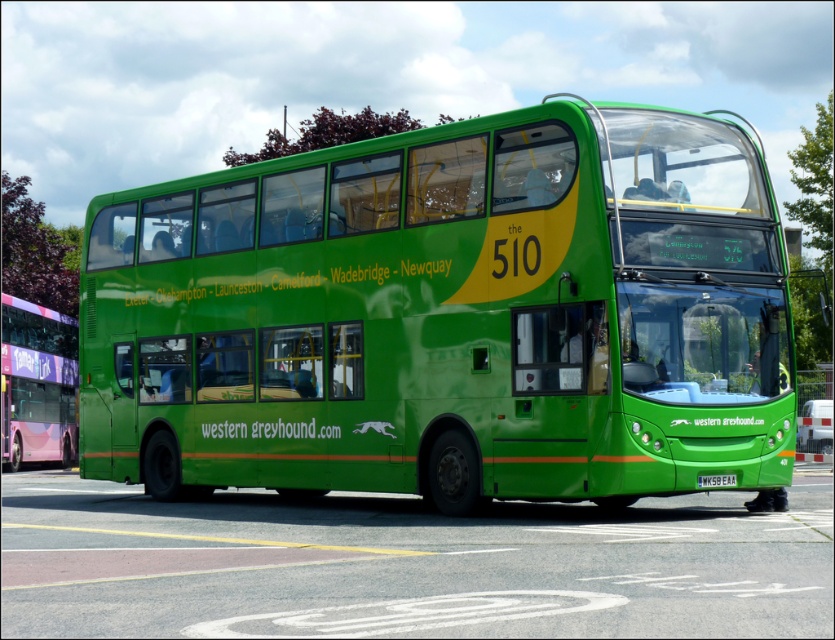
Question: Which of the following is the closest to the observer?

Choices:
 (A) (699, 483)
 (B) (138, 417)

Answer: (A)

Question: Can you confirm if green matte/deck bus at center is smaller than white plastic license plate at center?

Choices:
 (A) yes
 (B) no

Answer: (B)

Question: Does matte pink bus at left have a greater width compared to white plastic license plate at center?

Choices:
 (A) yes
 (B) no

Answer: (B)

Question: Can you confirm if matte pink bus at left is smaller than white plastic license plate at center?

Choices:
 (A) no
 (B) yes

Answer: (A)

Question: Among these objects, which one is nearest to the camera?

Choices:
 (A) white plastic license plate at center
 (B) green matte/deck bus at center
 (C) matte pink bus at left

Answer: (B)

Question: Which object appears closest to the camera in this image?

Choices:
 (A) white plastic license plate at center
 (B) green matte/deck bus at center
 (C) matte pink bus at left

Answer: (B)